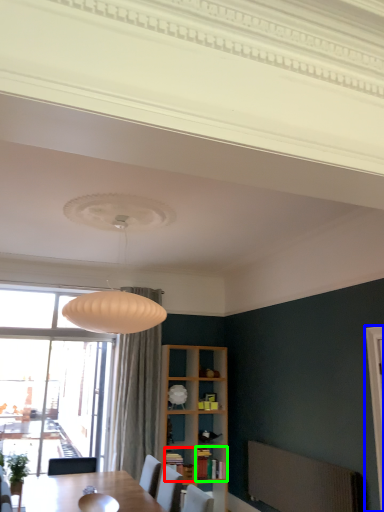
Question: Based on their relative distances, which object is nearer to shelf (highlighted by a red box)? Choose from screen door (highlighted by a blue box) and cabinet (highlighted by a green box).

Choices:
 (A) screen door
 (B) cabinet

Answer: (B)